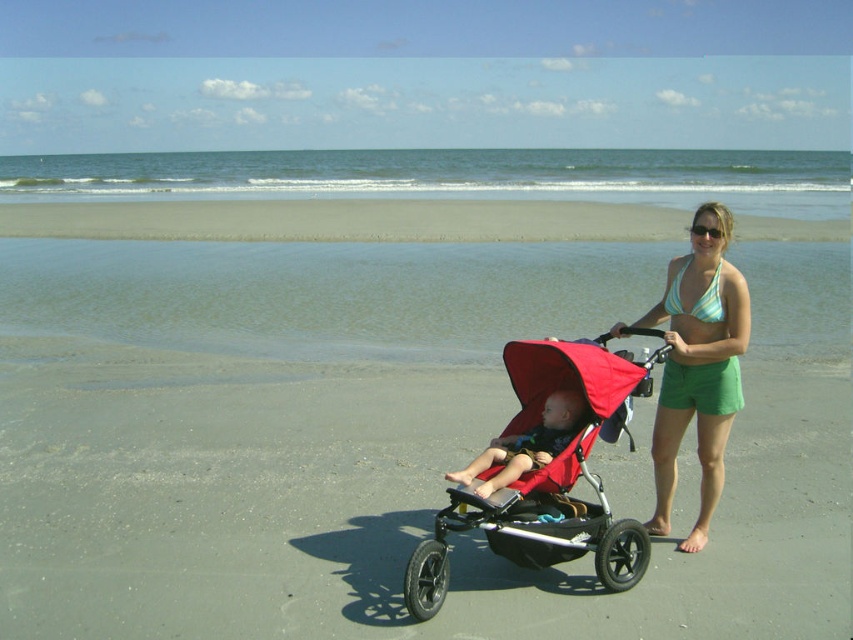
Consider the image. Who is positioned more to the left, green cotton shorts at center or matte red stroller at center?

matte red stroller at center

Which is in front, point (666, 356) or point (514, 468)?

Point (514, 468)

Does point (706, 435) come farther from viewer compared to point (558, 435)?

Yes, it is behind point (558, 435).

Find the location of a particular element. Image resolution: width=853 pixels, height=640 pixels. green cotton shorts at center is located at coordinates (698, 364).

Find the location of `gray sand beach at lower center`. gray sand beach at lower center is located at coordinates (345, 220).

Describe the element at coordinates (345, 220) in the screenshot. I see `gray sand beach at lower center` at that location.

You are a GUI agent. You are given a task and a screenshot of the screen. Output one action in this format:
    pyautogui.click(x=<x>, y=<y>)
    Task: Click on the gray sand beach at lower center
    
    Given the screenshot: What is the action you would take?
    pyautogui.click(x=345, y=220)

Who is more forward, (311,387) or (558,211)?

Point (311,387) is more forward.

Does matte black stroller at center appear under gray sand beach at lower center?

Indeed, matte black stroller at center is positioned under gray sand beach at lower center.

What do you see at coordinates (370, 444) in the screenshot? The width and height of the screenshot is (853, 640). I see `matte black stroller at center` at bounding box center [370, 444].

Locate an element on the screen. The height and width of the screenshot is (640, 853). matte black stroller at center is located at coordinates (370, 444).